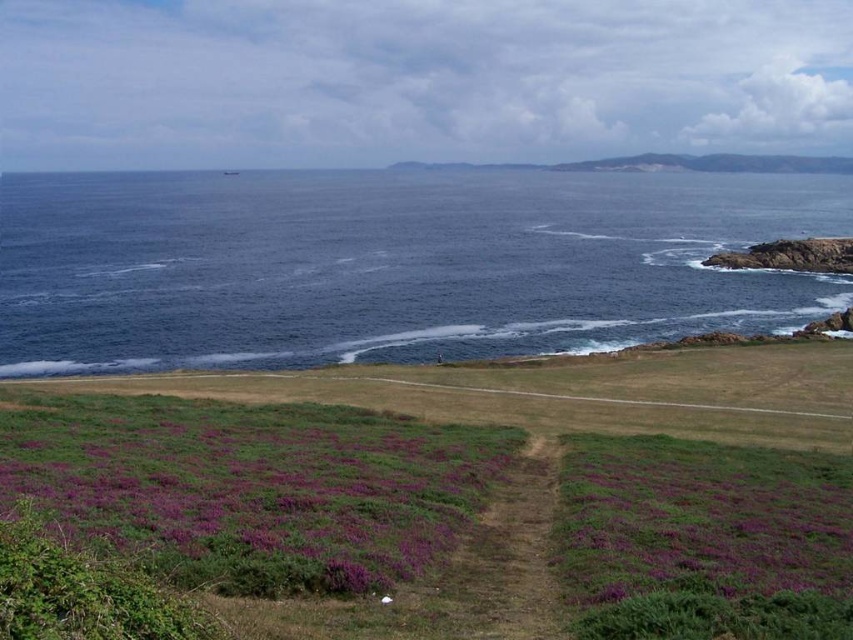
Is deep blue water at lower left positioned at the back of purple soft grass at lower center?

Yes, it is behind purple soft grass at lower center.

Who is taller, deep blue water at lower left or purple soft grass at lower center?

deep blue water at lower left is taller.

Measure the distance between deep blue water at lower left and camera.

A distance of 75.96 meters exists between deep blue water at lower left and camera.

Where is `deep blue water at lower left`? The image size is (853, 640). deep blue water at lower left is located at coordinates (392, 264).

This screenshot has height=640, width=853. What do you see at coordinates (252, 486) in the screenshot?
I see `purple soft grass at lower left` at bounding box center [252, 486].

Is point (401, 456) more distant than point (695, 531)?

Yes, point (401, 456) is behind point (695, 531).

This screenshot has height=640, width=853. What do you see at coordinates (252, 486) in the screenshot?
I see `purple soft grass at lower left` at bounding box center [252, 486].

Where is `purple soft grass at lower left`? Image resolution: width=853 pixels, height=640 pixels. purple soft grass at lower left is located at coordinates (252, 486).

Can you confirm if purple grassy at lower center is bigger than purple soft grass at lower center?

Yes.

Does purple grassy at lower center have a lesser height compared to purple soft grass at lower center?

Incorrect, purple grassy at lower center's height does not fall short of purple soft grass at lower center's.

Does point (567, 588) come in front of point (793, 483)?

That is True.

Locate an element on the screen. Image resolution: width=853 pixels, height=640 pixels. purple grassy at lower center is located at coordinates (457, 481).